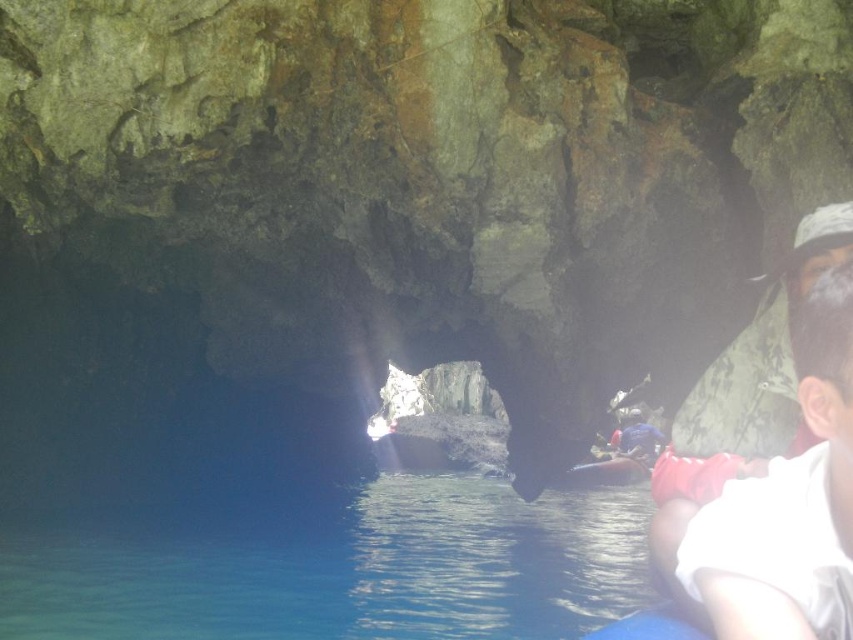
Does blue clear water at lower left have a smaller size compared to white matte shirt at right?

Incorrect, blue clear water at lower left is not smaller in size than white matte shirt at right.

The height and width of the screenshot is (640, 853). What do you see at coordinates (334, 566) in the screenshot?
I see `blue clear water at lower left` at bounding box center [334, 566].

At what (x,y) coordinates should I click in order to perform the action: click on blue clear water at lower left. Please return your answer as a coordinate pair (x, y). Image resolution: width=853 pixels, height=640 pixels. Looking at the image, I should click on (334, 566).